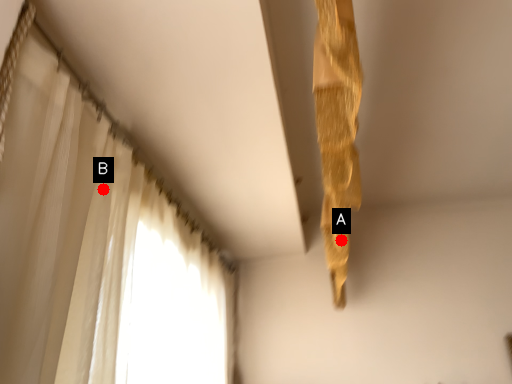
Question: Two points are circled on the image, labeled by A and B beside each circle. Which point is farther to the camera?

Choices:
 (A) A is further
 (B) B is further

Answer: (A)